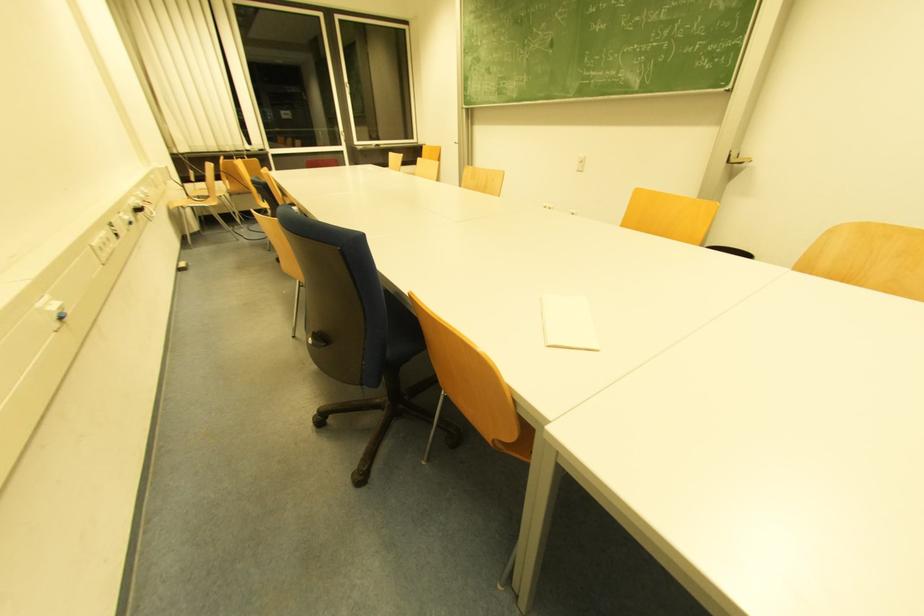
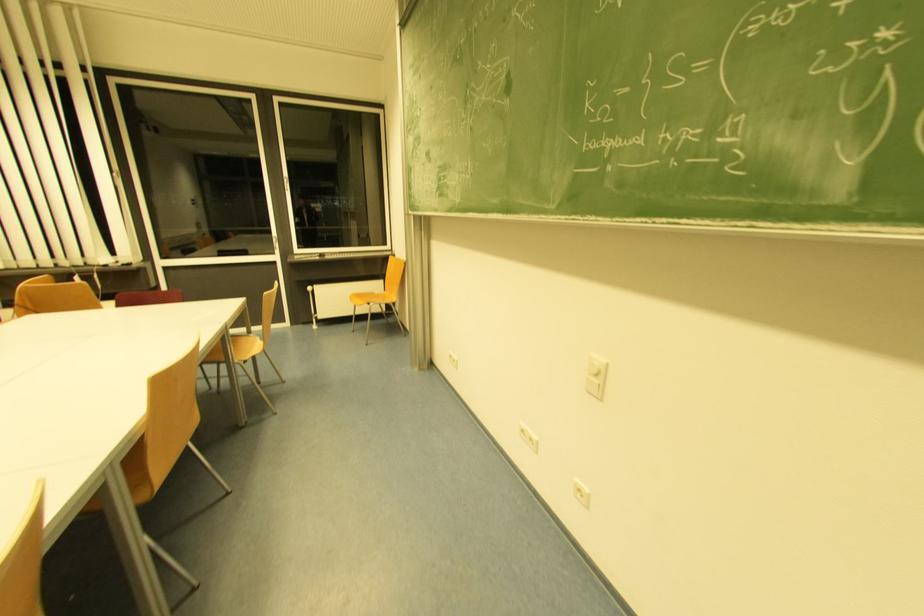
In the scene shown: Which direction would the cameraman need to move to produce the second image?

→ The movement direction of the cameraman is right, forward.